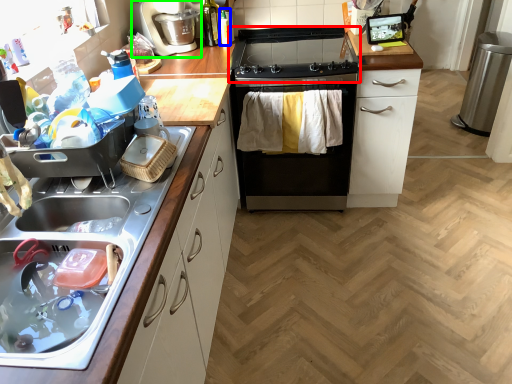
Question: Which object is positioned closest to gas stove (highlighted by a red box)? Select from bottle (highlighted by a blue box) and coffee machine (highlighted by a green box).

Choices:
 (A) bottle
 (B) coffee machine

Answer: (A)